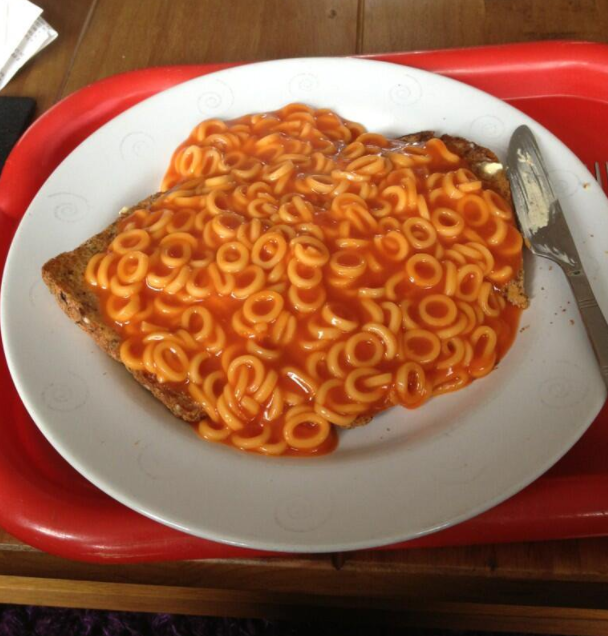
This screenshot has height=636, width=608. What are the coordinates of `pattern design on plate` in the screenshot? It's located at (125, 137).